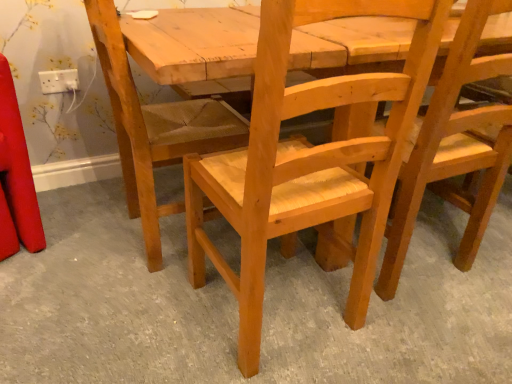
At what (x,y) coordinates should I click in order to perform the action: click on vacant space underneath natural wood chair at center, the 1th chair viewed from the right (from a real-world perspective). Please return your answer as a coordinate pair (x, y). Looking at the image, I should click on (426, 262).